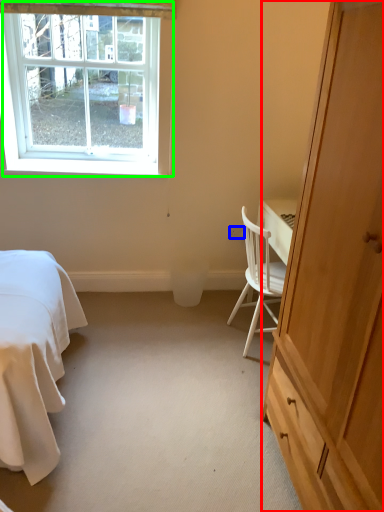
Question: Which object is the closest to the cabinetry (highlighted by a red box)? Choose among these: power outlet (highlighted by a blue box) or window (highlighted by a green box).

Choices:
 (A) power outlet
 (B) window

Answer: (A)